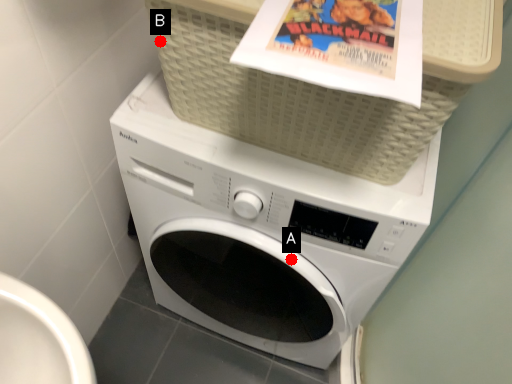
Question: Two points are circled on the image, labeled by A and B beside each circle. Which point is further to the camera?

Choices:
 (A) A is further
 (B) B is further

Answer: (A)